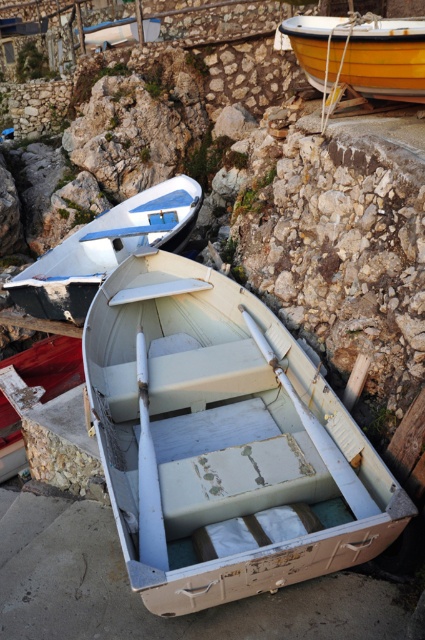
You are a photographer wanting to capture both the white matte boat at upper center and the yellow polished wood boat at upper right in a single frame. Based on their positions, which boat should you focus on first to ensure both are in the shot?

You should focus on the white matte boat at upper center first because it is positioned to the left of the yellow polished wood boat at upper right, allowing you to frame both boats by starting with the one on the left.